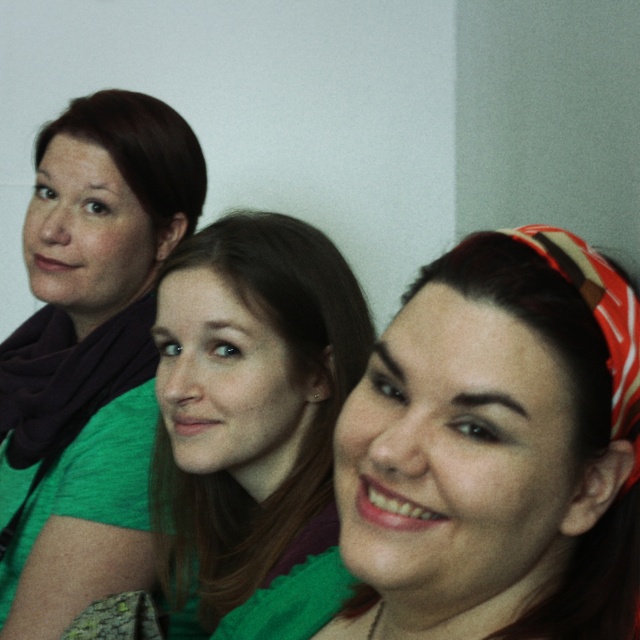
You are standing at the point marked as point [552,237]. You want to walk to the nearest person. Which person should you walk towards?

The nearest person to point [552,237] is the person on the right, so you should walk towards the person on the right.

Looking at the three people in the scene, which scarf is positioned to the right of the other between the green knitted scarf at center and the matte black scarf at left?

The green knitted scarf at center is positioned to the right of the matte black scarf at left.